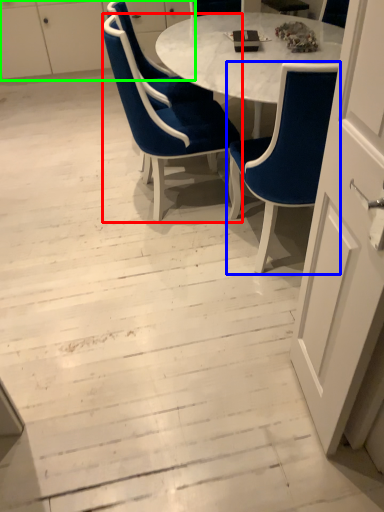
Question: Which object is positioned farthest from chair (highlighted by a red box)? Select from chair (highlighted by a blue box) and dresser (highlighted by a green box).

Choices:
 (A) chair
 (B) dresser

Answer: (B)